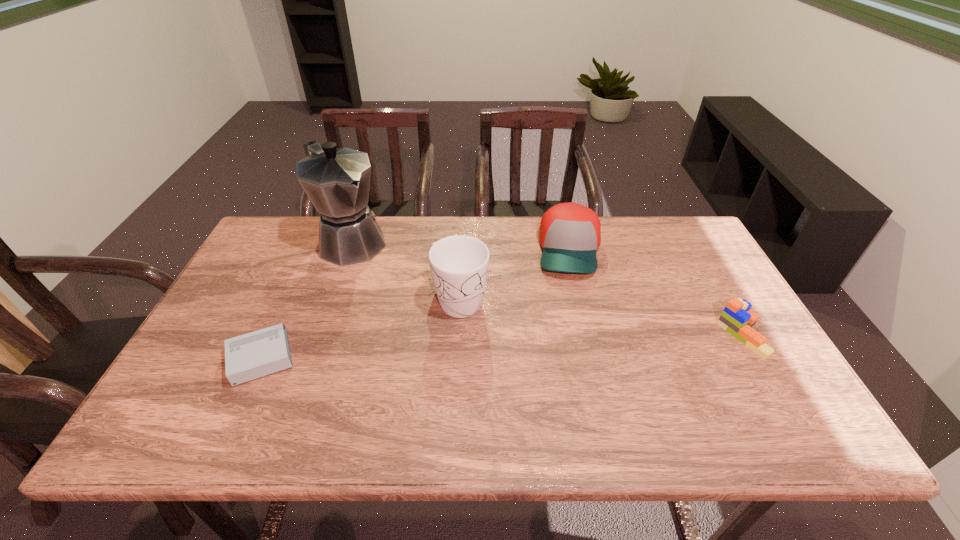
In order to click on free space on the desktop that is between the shortest object and the Lego and is positioned at the spout of the tallest object in this screenshot , I will do `click(460, 348)`.

Identify the location of vacant space on the desktop that is between the alarm clock and the second shortest object and is positioned on the side of the third object from right to left with the handle. (504, 346).

Locate an element on the screen. The width and height of the screenshot is (960, 540). free spot on the desktop that is between the shortest object and the fourth tallest object and is positioned at the brim of the third shortest object is located at coordinates (573, 342).